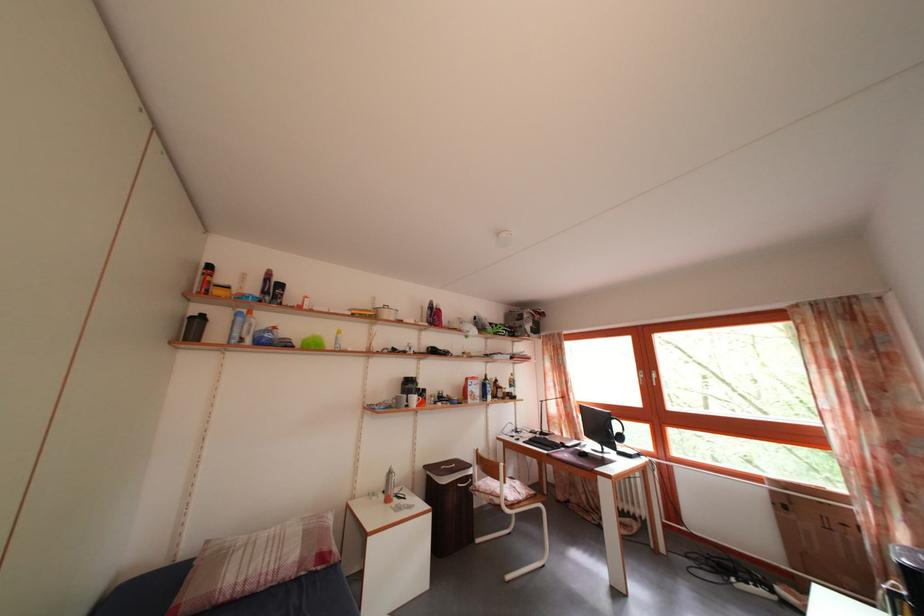
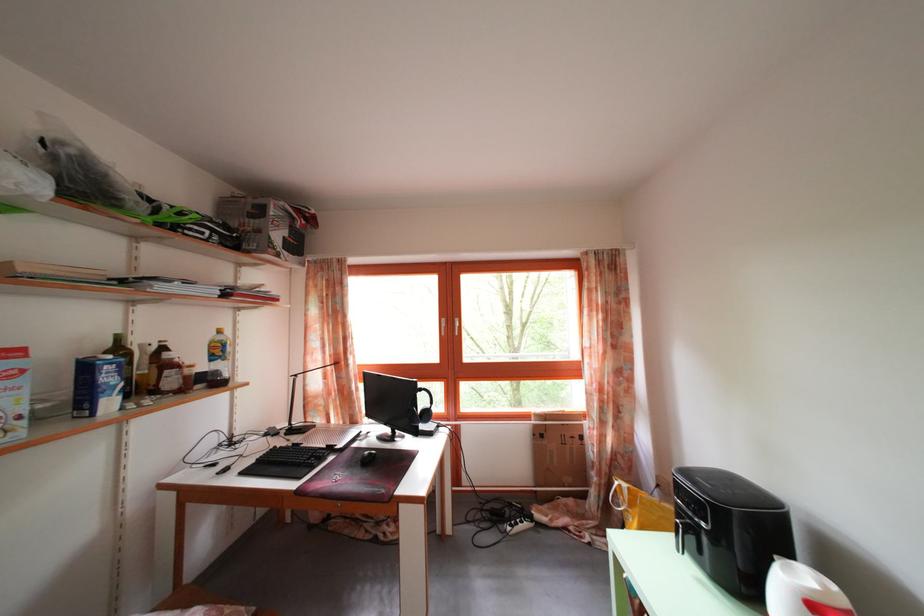
Where in the second image is the point corresponding to (496,405) from the first image?

(117, 410)